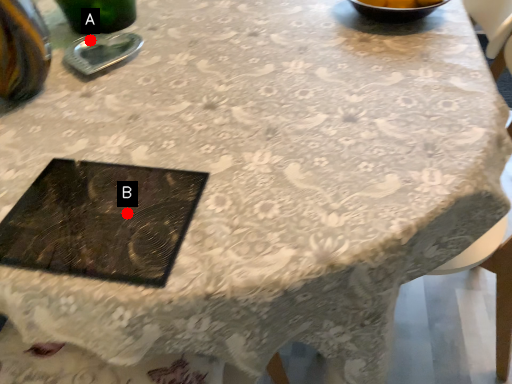
Question: Two points are circled on the image, labeled by A and B beside each circle. Which point is farther from the camera taking this photo?

Choices:
 (A) A is further
 (B) B is further

Answer: (A)